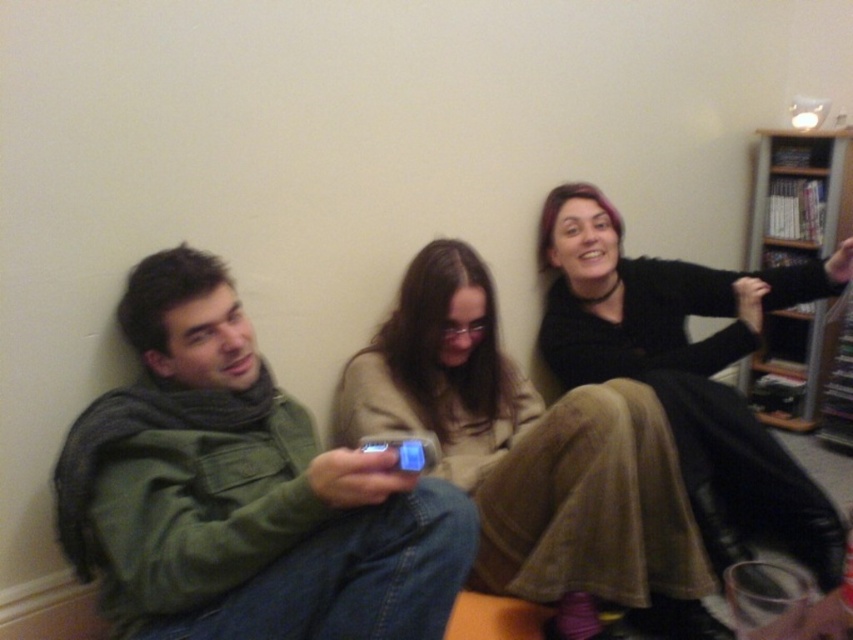
Question: Does matte beige pants at center appear over wooden bookshelf at upper right?

Choices:
 (A) yes
 (B) no

Answer: (B)

Question: From the image, what is the correct spatial relationship of green matte jacket at center in relation to matte beige pants at center?

Choices:
 (A) below
 (B) above

Answer: (B)

Question: Which of the following is the farthest from the observer?

Choices:
 (A) green matte jacket at center
 (B) wooden bookshelf at upper right
 (C) matte beige pants at center

Answer: (B)

Question: Among these points, which one is farthest from the camera?

Choices:
 (A) (154, 465)
 (B) (473, 472)
 (C) (775, 131)

Answer: (C)

Question: Does matte beige pants at center have a smaller size compared to wooden bookshelf at upper right?

Choices:
 (A) no
 (B) yes

Answer: (A)

Question: Which point is closer to the camera taking this photo?

Choices:
 (A) (109, 500)
 (B) (527, 392)

Answer: (A)